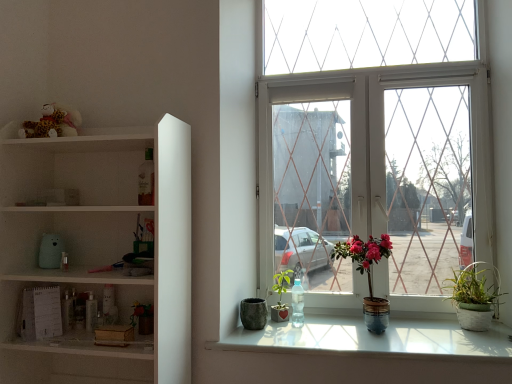
Question: Is white glossy window sill at lower center oriented away from green matte plant at center, arranged as the 2th houseplant when viewed from the left?

Choices:
 (A) yes
 (B) no

Answer: (B)

Question: Is white glossy window sill at lower center thinner than green matte plant at center, which is the 3th houseplant in right-to-left order?

Choices:
 (A) no
 (B) yes

Answer: (A)

Question: From the image's perspective, is white glossy window sill at lower center below green matte plant at center, which is the 3th houseplant in right-to-left order?

Choices:
 (A) yes
 (B) no

Answer: (A)

Question: Is white glossy window sill at lower center wider than green matte plant at center, which is the 3th houseplant in right-to-left order?

Choices:
 (A) no
 (B) yes

Answer: (B)

Question: Is white glossy window sill at lower center at the left side of green matte plant at center, which is the 3th houseplant in right-to-left order?

Choices:
 (A) yes
 (B) no

Answer: (B)

Question: Is white glossy window sill at lower center smaller than green matte plant at center, which is the 3th houseplant in right-to-left order?

Choices:
 (A) no
 (B) yes

Answer: (A)

Question: Would you say transparent plastic bottle at window contains matte gray stone pot at lower center?

Choices:
 (A) no
 (B) yes

Answer: (A)

Question: Does transparent plastic bottle at window have a larger size compared to matte gray stone pot at lower center?

Choices:
 (A) no
 (B) yes

Answer: (A)

Question: From the image's perspective, is transparent plastic bottle at window below matte gray stone pot at lower center?

Choices:
 (A) yes
 (B) no

Answer: (B)

Question: Can you confirm if transparent plastic bottle at window is wider than matte gray stone pot at lower center?

Choices:
 (A) yes
 (B) no

Answer: (B)

Question: From a real-world perspective, is transparent plastic bottle at window under matte gray stone pot at lower center?

Choices:
 (A) no
 (B) yes

Answer: (A)

Question: Considering the relative positions of transparent plastic bottle at window and matte gray stone pot at lower center in the image provided, is transparent plastic bottle at window behind matte gray stone pot at lower center?

Choices:
 (A) no
 (B) yes

Answer: (B)

Question: From the image's perspective, would you say green matte plant at lower left, placed as the fourth houseplant when sorted from right to left, is positioned over matte gray stone pot at lower center?

Choices:
 (A) yes
 (B) no

Answer: (A)